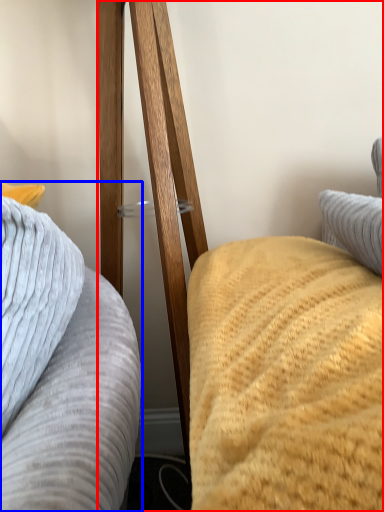
Question: Which object is further to the camera taking this photo, furniture (highlighted by a red box) or furniture (highlighted by a blue box)?

Choices:
 (A) furniture
 (B) furniture

Answer: (B)